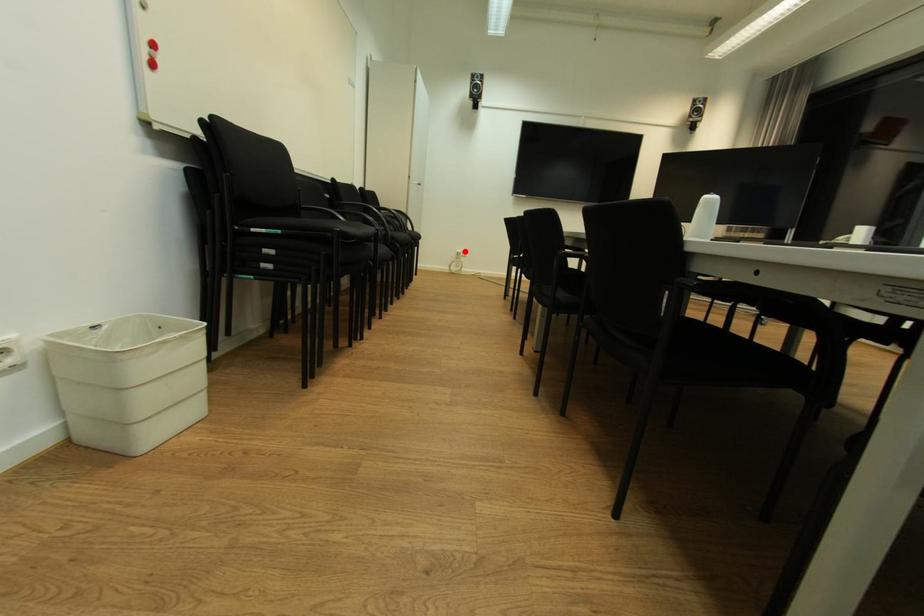
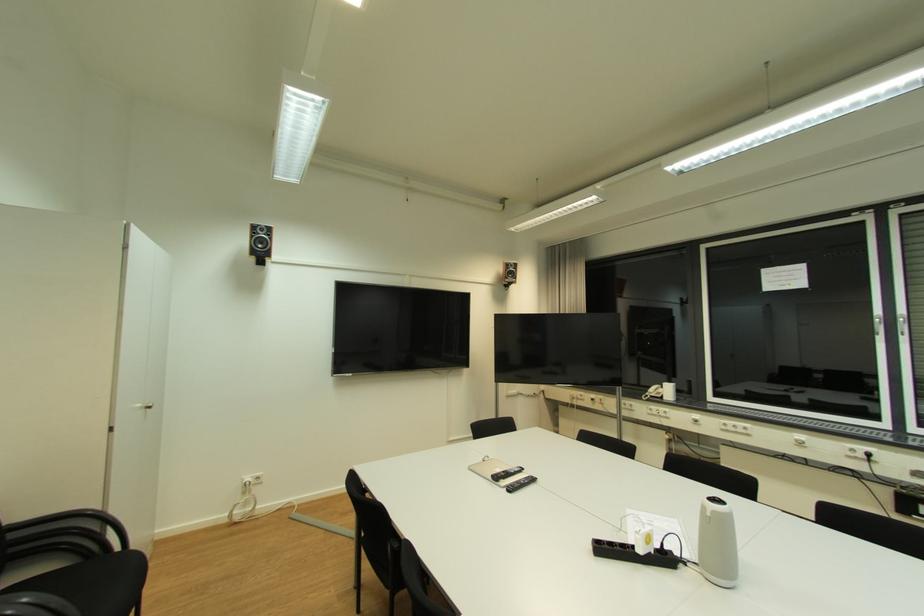
Question: I am providing you with two images of the same scene from different viewpoints. A red point is shown in image1. For the corresponding object point in image2, is it positioned nearer or farther from the camera?

Choices:
 (A) Nearer
 (B) Farther

Answer: (B)